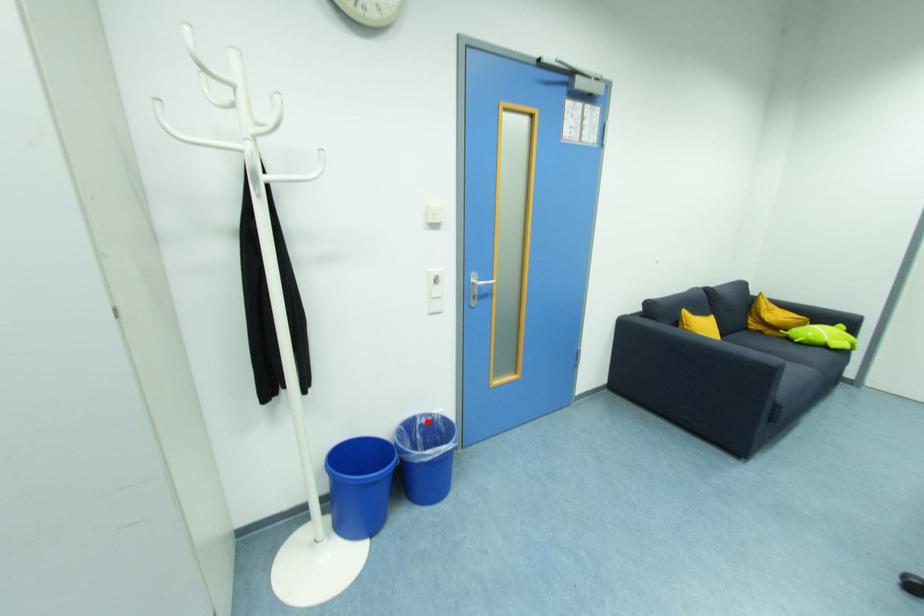
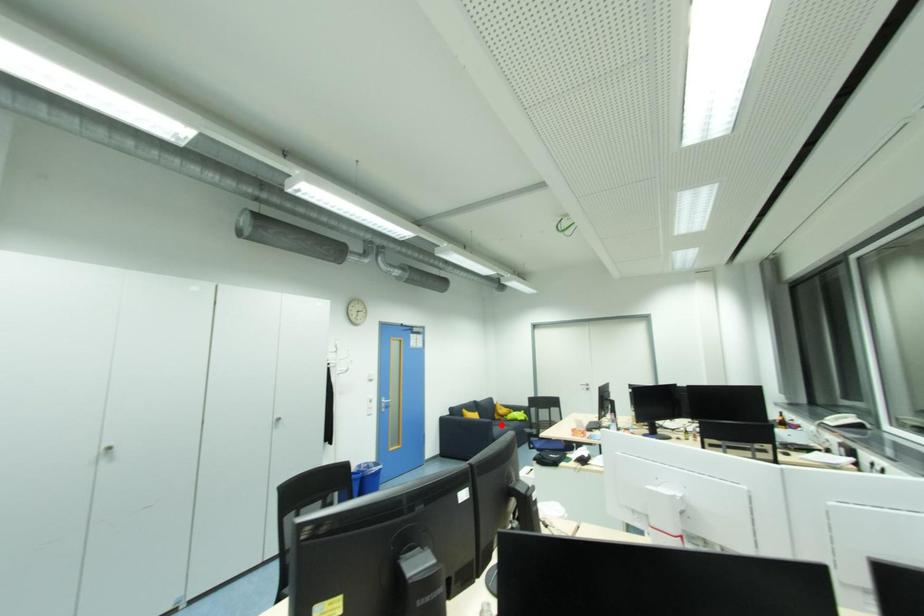
I am providing you with two images of the same scene from different viewpoints. A red point is marked on the first image and another point is marked on the second image. Does the point marked in image1 correspond to the same location as the one in image2?

No